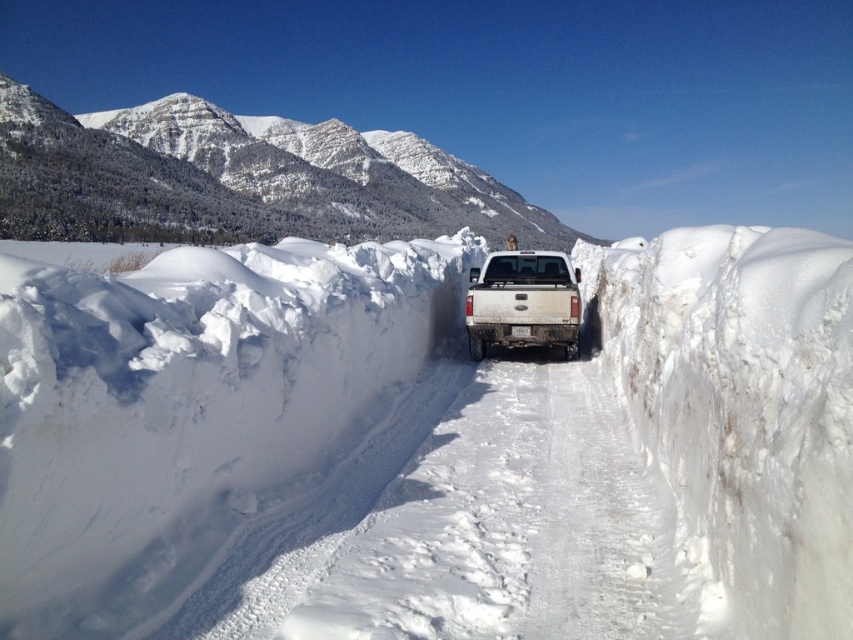
Question: Is white fluffy snow at center further to the viewer compared to white matte truck at center?

Choices:
 (A) no
 (B) yes

Answer: (A)

Question: Does snowy granite mountain at upper center have a smaller size compared to white matte truck at center?

Choices:
 (A) yes
 (B) no

Answer: (B)

Question: Which is nearer to the white fluffy snow at center?

Choices:
 (A) white matte truck at center
 (B) snowy granite mountain at upper center

Answer: (A)

Question: Is snowy granite mountain at upper center positioned in front of white matte truck at center?

Choices:
 (A) no
 (B) yes

Answer: (A)

Question: Among these objects, which one is nearest to the camera?

Choices:
 (A) white fluffy snow at center
 (B) snowy granite mountain at upper center

Answer: (A)

Question: Among these objects, which one is nearest to the camera?

Choices:
 (A) white fluffy snow at center
 (B) white matte truck at center
 (C) snowy granite mountain at upper center

Answer: (A)